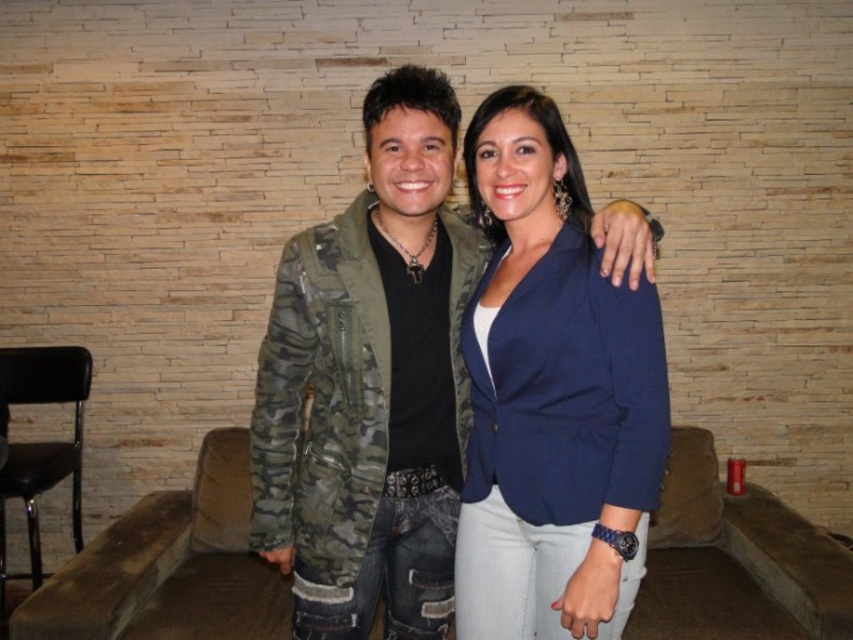
Question: Can you confirm if camo jacket at center is positioned above navy blue blazer at center?

Choices:
 (A) no
 (B) yes

Answer: (A)

Question: Which point is closer to the camera?

Choices:
 (A) (509, 156)
 (B) (339, 276)

Answer: (A)

Question: Can you confirm if camo jacket at center is bigger than navy blue blazer at center?

Choices:
 (A) yes
 (B) no

Answer: (A)

Question: Which object appears closest to the camera in this image?

Choices:
 (A) navy blue blazer at center
 (B) camo jacket at center

Answer: (A)

Question: Among these points, which one is nearest to the camera?

Choices:
 (A) (636, 464)
 (B) (412, 544)

Answer: (A)

Question: Can you confirm if camo jacket at center is positioned above navy blue blazer at center?

Choices:
 (A) yes
 (B) no

Answer: (B)